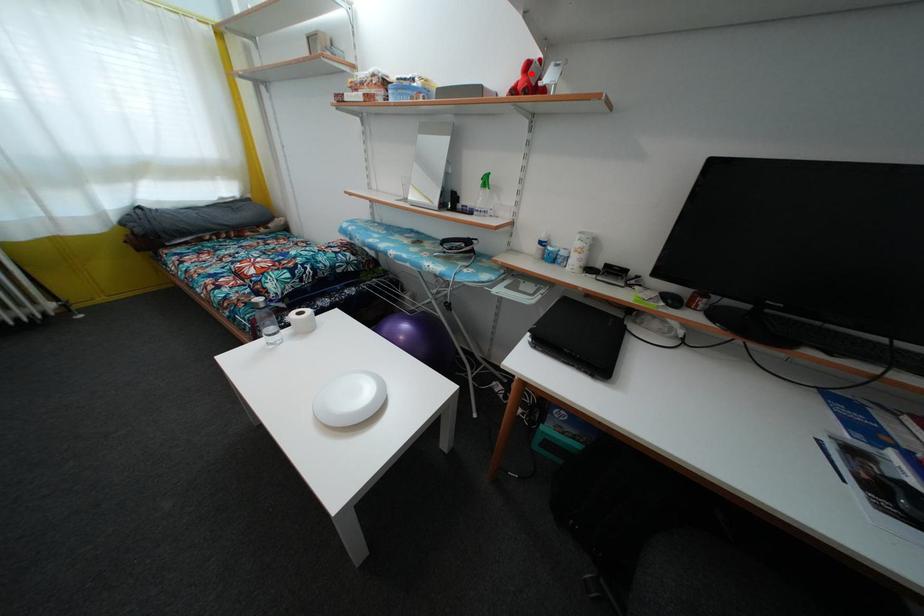
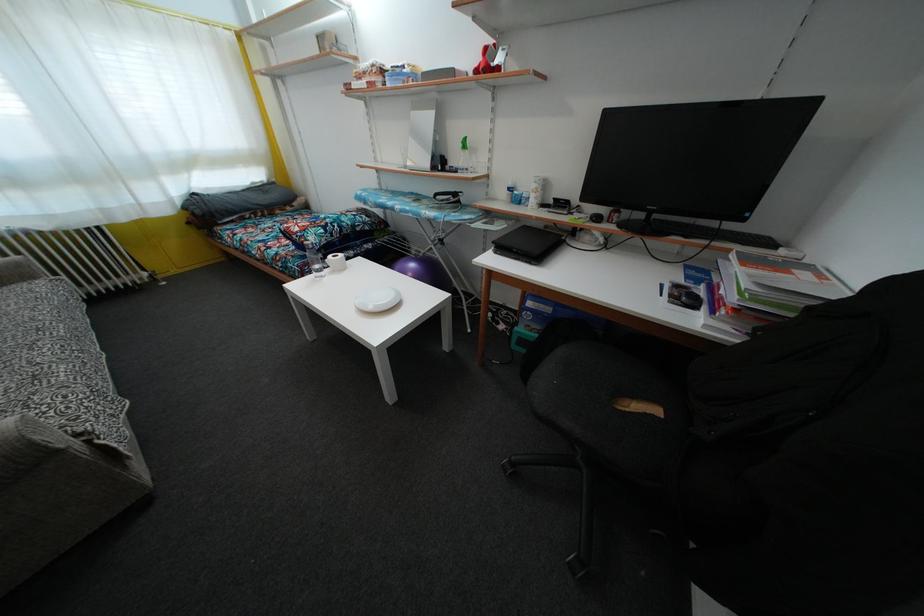
Find the pixel in the second image that matches the highlighted location in the first image.

(490, 58)